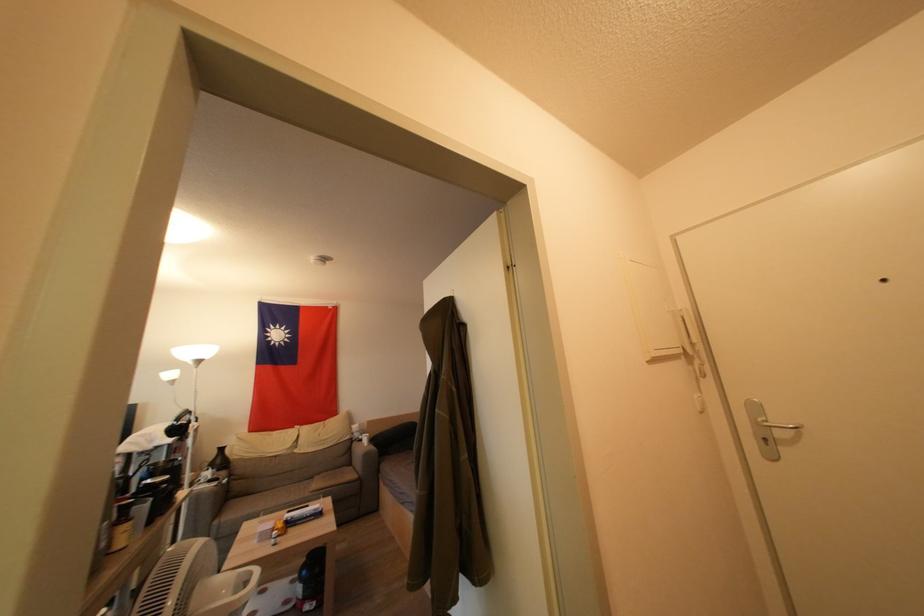
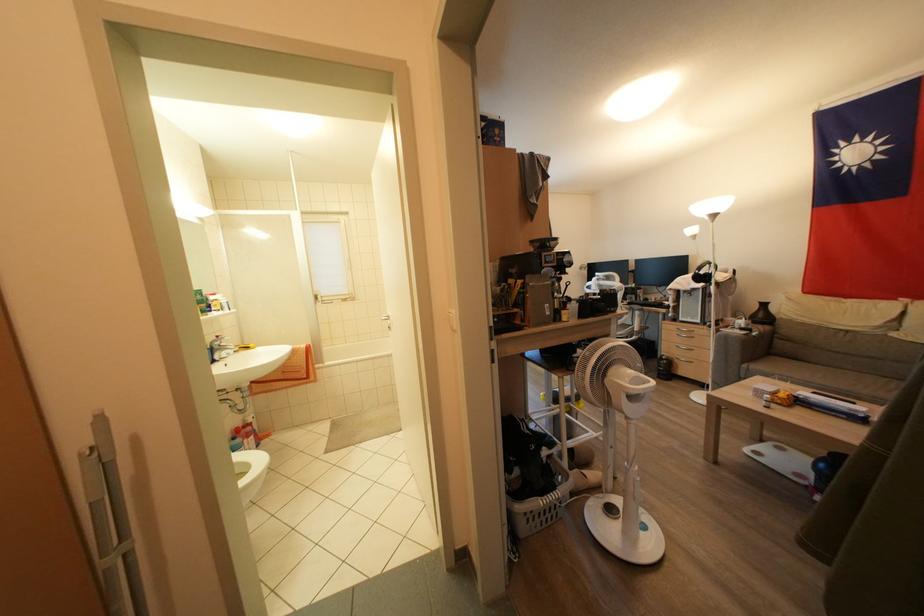
In the second image, find the point that corresponds to (224,464) in the first image.

(766, 320)